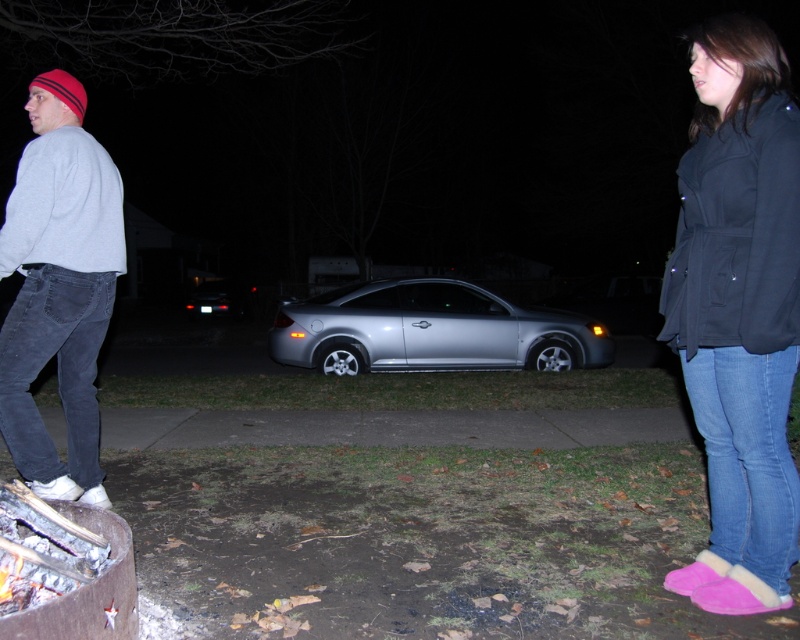
Can you confirm if dark blue fleece jacket at right is taller than gray cotton sweatshirt at left?

Incorrect, dark blue fleece jacket at right's height is not larger of gray cotton sweatshirt at left's.

Does point (754, 346) lie in front of point (28, 273)?

Yes, it is.

Find the location of a particular element. dark blue fleece jacket at right is located at coordinates (740, 310).

Does dark blue fleece jacket at right appear under silver metallic car at center?

No, dark blue fleece jacket at right is not below silver metallic car at center.

In the scene shown: Is dark blue fleece jacket at right taller than silver metallic car at center?

Indeed, dark blue fleece jacket at right has a greater height compared to silver metallic car at center.

This screenshot has height=640, width=800. What are the coordinates of `dark blue fleece jacket at right` in the screenshot? It's located at (740, 310).

Where is `dark blue fleece jacket at right`? This screenshot has height=640, width=800. dark blue fleece jacket at right is located at coordinates (740, 310).

Can you confirm if gray cotton sweatshirt at left is thinner than silver metallic car at center?

Yes, gray cotton sweatshirt at left is thinner than silver metallic car at center.

Which is in front, point (38, 275) or point (536, 330)?

Point (38, 275) is more forward.

Which is in front, point (76, 196) or point (424, 317)?

Point (76, 196)

Image resolution: width=800 pixels, height=640 pixels. Find the location of `gray cotton sweatshirt at left`. gray cotton sweatshirt at left is located at coordinates (58, 288).